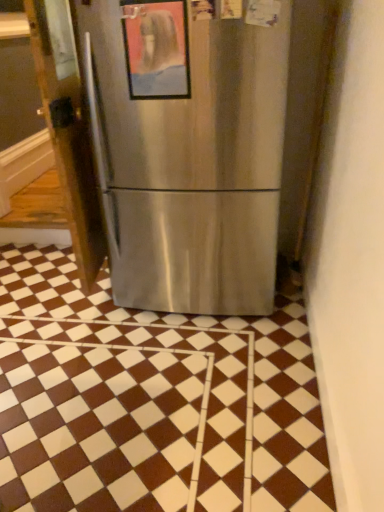
Question: Can you confirm if satin silver refrigerator at left is positioned to the left of metallic framed picture at center?

Choices:
 (A) no
 (B) yes

Answer: (B)

Question: Considering the relative sizes of satin silver refrigerator at left and metallic framed picture at center in the image provided, is satin silver refrigerator at left shorter than metallic framed picture at center?

Choices:
 (A) yes
 (B) no

Answer: (B)

Question: Is metallic framed picture at center surrounded by satin silver refrigerator at left?

Choices:
 (A) no
 (B) yes

Answer: (A)

Question: Is satin silver refrigerator at left positioned far away from metallic framed picture at center?

Choices:
 (A) yes
 (B) no

Answer: (B)

Question: From a real-world perspective, is satin silver refrigerator at left on metallic framed picture at center?

Choices:
 (A) yes
 (B) no

Answer: (B)

Question: In terms of size, does brown/white checkered tile at center appear bigger or smaller than satin silver refrigerator at left?

Choices:
 (A) small
 (B) big

Answer: (B)

Question: In terms of height, does brown/white checkered tile at center look taller or shorter compared to satin silver refrigerator at left?

Choices:
 (A) tall
 (B) short

Answer: (B)

Question: Considering the relative positions of brown/white checkered tile at center and satin silver refrigerator at left in the image provided, is brown/white checkered tile at center to the left or to the right of satin silver refrigerator at left?

Choices:
 (A) right
 (B) left

Answer: (A)

Question: In terms of width, does brown/white checkered tile at center look wider or thinner when compared to satin silver refrigerator at left?

Choices:
 (A) thin
 (B) wide

Answer: (B)

Question: From the image's perspective, is satin silver refrigerator at left located above or below metallic framed picture at center?

Choices:
 (A) above
 (B) below

Answer: (A)

Question: In terms of height, does satin silver refrigerator at left look taller or shorter compared to metallic framed picture at center?

Choices:
 (A) tall
 (B) short

Answer: (A)

Question: Based on their sizes in the image, would you say satin silver refrigerator at left is bigger or smaller than metallic framed picture at center?

Choices:
 (A) big
 (B) small

Answer: (A)

Question: Would you say satin silver refrigerator at left is to the left or to the right of metallic framed picture at center in the picture?

Choices:
 (A) right
 (B) left

Answer: (B)

Question: Based on their sizes in the image, would you say satin silver refrigerator at left is bigger or smaller than brown/white checkered tile at center?

Choices:
 (A) small
 (B) big

Answer: (A)

Question: From a real-world perspective, is satin silver refrigerator at left positioned above or below brown/white checkered tile at center?

Choices:
 (A) above
 (B) below

Answer: (A)